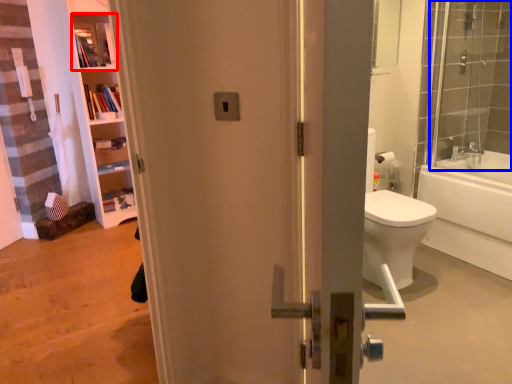
Question: Which object appears closest to the camera in this image, shelf (highlighted by a red box) or shower door (highlighted by a blue box)?

Choices:
 (A) shelf
 (B) shower door

Answer: (B)